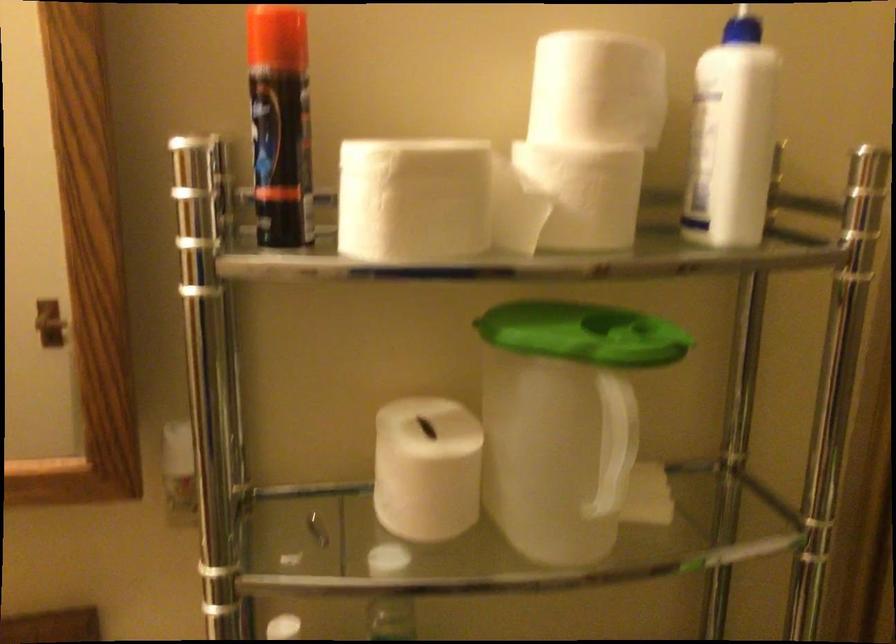
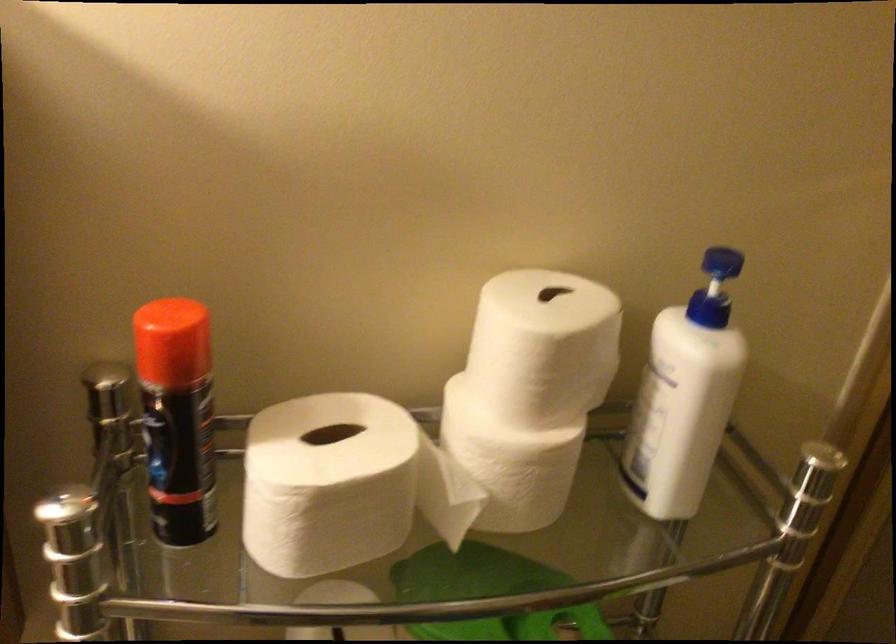
Question: The images are taken continuously from a first-person perspective. In which direction is your viewpoint rotating?

Choices:
 (A) Left
 (B) Right
 (C) Up
 (D) Down

Answer: (D)